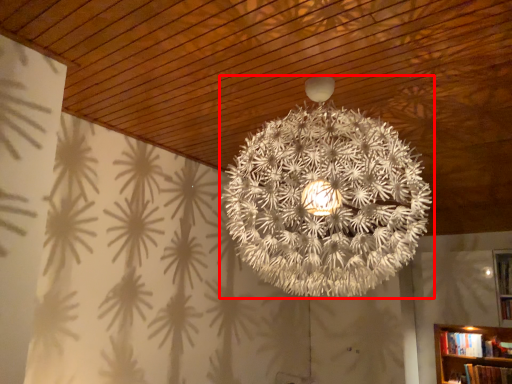
Question: Observing the image, what is the correct spatial positioning of lamp (annotated by the red box) in reference to book?

Choices:
 (A) left
 (B) right

Answer: (A)